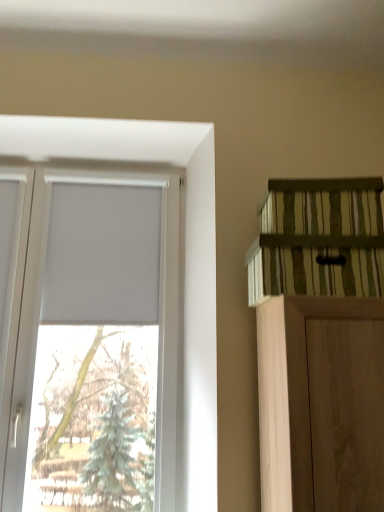
Where is `white matte window at upper left`? This screenshot has height=512, width=384. white matte window at upper left is located at coordinates (185, 248).

What do you see at coordinates (185, 248) in the screenshot? I see `white matte window at upper left` at bounding box center [185, 248].

Describe the element at coordinates (319, 240) in the screenshot. I see `green striped wood shelf at upper right` at that location.

At what (x,y) coordinates should I click in order to perform the action: click on green striped wood shelf at upper right. Please return your answer as a coordinate pair (x, y). Image resolution: width=384 pixels, height=512 pixels. Looking at the image, I should click on (319, 240).

Identify the location of white matte window at upper left. Image resolution: width=384 pixels, height=512 pixels. (185, 248).

Can you confirm if white matte window at upper left is positioned to the left of green striped wood shelf at upper right?

Indeed, white matte window at upper left is positioned on the left side of green striped wood shelf at upper right.

Relative to green striped wood shelf at upper right, is white matte window at upper left in front or behind?

white matte window at upper left is positioned farther from the viewer than green striped wood shelf at upper right.

Is point (200, 315) closer or farther from the camera than point (344, 233)?

Point (200, 315) is positioned farther from the camera compared to point (344, 233).

From the image's perspective, is white matte window at upper left positioned above or below green striped wood shelf at upper right?

white matte window at upper left is situated lower than green striped wood shelf at upper right in the image.

From a real-world perspective, who is located higher, white matte window at upper left or green striped wood shelf at upper right?

From a 3D spatial view, green striped wood shelf at upper right is above.

Is white matte window at upper left wider or thinner than green striped wood shelf at upper right?

Clearly, white matte window at upper left has less width compared to green striped wood shelf at upper right.

Is white matte window at upper left taller or shorter than green striped wood shelf at upper right?

Clearly, white matte window at upper left is taller compared to green striped wood shelf at upper right.

Can you confirm if white matte window at upper left is bigger than green striped wood shelf at upper right?

Yes, white matte window at upper left is bigger than green striped wood shelf at upper right.

Which is correct: white matte window at upper left is inside green striped wood shelf at upper right, or outside of it?

white matte window at upper left is outside green striped wood shelf at upper right.

Is white matte window at upper left not near green striped wood shelf at upper right?

No.

From the picture: Is white matte window at upper left looking in the opposite direction of green striped wood shelf at upper right?

That's not correct — white matte window at upper left is not looking away from green striped wood shelf at upper right.

How many degrees apart are the facing directions of white matte window at upper left and green striped wood shelf at upper right?

4.78 degrees separate the facing orientations of white matte window at upper left and green striped wood shelf at upper right.

In the image, there is a green striped wood shelf at upper right. Where is `window below it (from the image's perspective)`? This screenshot has height=512, width=384. window below it (from the image's perspective) is located at coordinates (185, 248).

Considering the positions of objects green striped wood shelf at upper right and white matte window at upper left in the image provided, who is more to the right, green striped wood shelf at upper right or white matte window at upper left?

From the viewer's perspective, green striped wood shelf at upper right appears more on the right side.

Considering the positions of objects green striped wood shelf at upper right and white matte window at upper left in the image provided, who is behind, green striped wood shelf at upper right or white matte window at upper left?

Positioned behind is white matte window at upper left.

Based on the photo, which point is more distant from viewer, (361, 196) or (55, 137)?

The point (55, 137) is farther from the camera.

From the image's perspective, is green striped wood shelf at upper right over white matte window at upper left?

Correct, green striped wood shelf at upper right appears higher than white matte window at upper left in the image.

From a real-world perspective, is green striped wood shelf at upper right physically above white matte window at upper left?

Yes.

Does green striped wood shelf at upper right have a lesser width compared to white matte window at upper left?

No, green striped wood shelf at upper right is not thinner than white matte window at upper left.

Does green striped wood shelf at upper right have a greater height compared to white matte window at upper left?

Incorrect, the height of green striped wood shelf at upper right is not larger of that of white matte window at upper left.

Does green striped wood shelf at upper right have a larger size compared to white matte window at upper left?

No, green striped wood shelf at upper right is not bigger than white matte window at upper left.

Consider the image. Is green striped wood shelf at upper right situated inside white matte window at upper left or outside?

green striped wood shelf at upper right exists outside the volume of white matte window at upper left.

Would you say green striped wood shelf at upper right is a long distance from white matte window at upper left?

Actually, green striped wood shelf at upper right and white matte window at upper left are a little close together.

Could you tell me if green striped wood shelf at upper right is facing white matte window at upper left?

No, green striped wood shelf at upper right is not facing towards white matte window at upper left.

Measure the distance from green striped wood shelf at upper right to white matte window at upper left.

23.04 inches.

The image size is (384, 512). I want to click on window lying behind the green striped wood shelf at upper right, so click(185, 248).

Identify the location of window on the left of green striped wood shelf at upper right. (185, 248).

Identify the location of shelf that is in front of the white matte window at upper left. (319, 240).